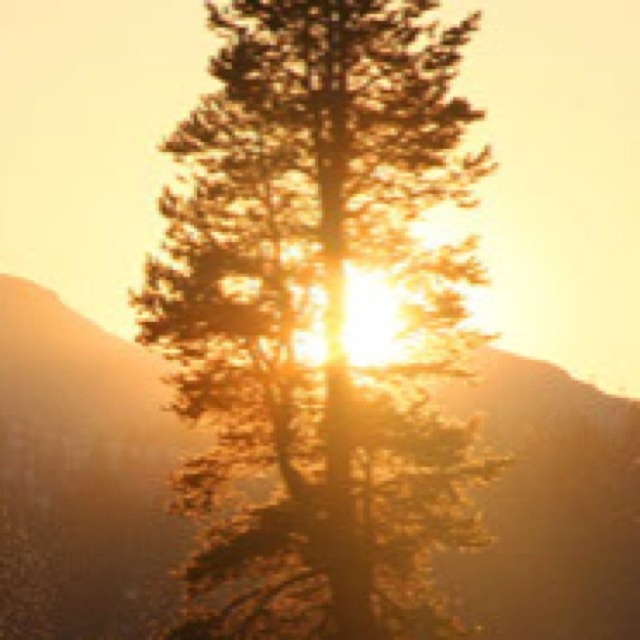
You are an artist trying to paint the sunset scene. You want to ensure the brown textured tree at center is properly positioned relative to the matte brown mountain at center. According to the scene, which object should appear closer to you?

The brown textured tree at center should appear closer to you since it is in front of the matte brown mountain at center.

You are an artist trying to sketch this sunset scene. You need to place the brown textured tree at center and the matte brown mountain at center in your drawing. According to the scene, which object should you draw first to ensure proper placement?

You should draw the matte brown mountain at center first because the brown textured tree at center is positioned on its left side, meaning the mountain is closer to the center and the tree is placed relative to it.

You are an artist trying to paint the sunset scene. You need to decide which object, the brown textured tree at center or the matte brown mountain at center, should be placed higher on your canvas to accurately represent their sizes. Which one should you choose?

The brown textured tree at center has a greater height compared to matte brown mountain at center, so you should place the brown textured tree at center higher on your canvas to accurately represent their sizes.